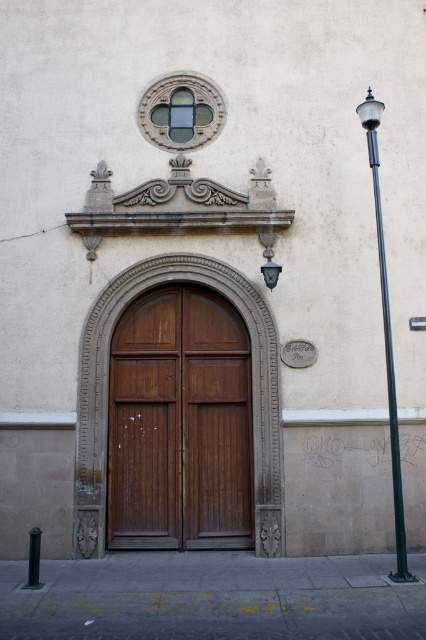
Between wooden door at center and black metal pole at right, which one has less height?

With less height is wooden door at center.

Can you confirm if wooden door at center is positioned to the right of black metal pole at right?

No, wooden door at center is not to the right of black metal pole at right.

Describe the element at coordinates (180, 424) in the screenshot. I see `wooden door at center` at that location.

Locate an element on the screen. The height and width of the screenshot is (640, 426). wooden door at center is located at coordinates (180, 424).